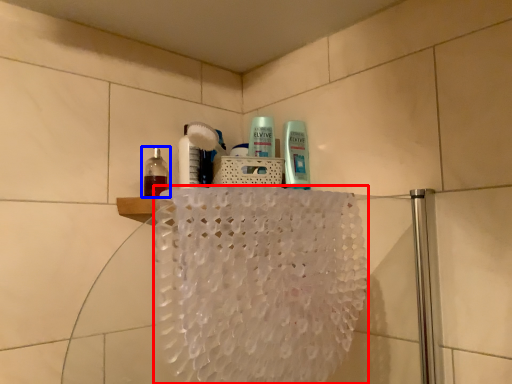
Question: Which of the following is the closest to the observer, bath towel (highlighted by a red box) or bottle (highlighted by a blue box)?

Choices:
 (A) bath towel
 (B) bottle

Answer: (A)